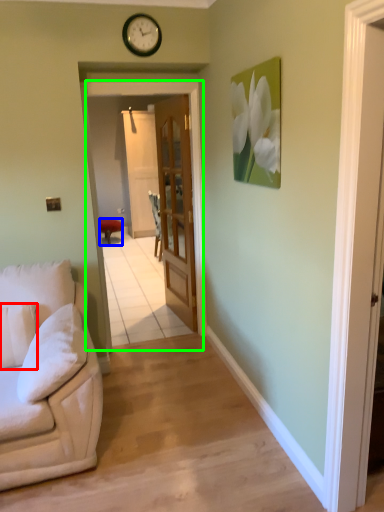
Question: Considering the real-world distances, which object is farthest from pillow (highlighted by a red box)? furniture (highlighted by a blue box) or screen door (highlighted by a green box)?

Choices:
 (A) furniture
 (B) screen door

Answer: (A)